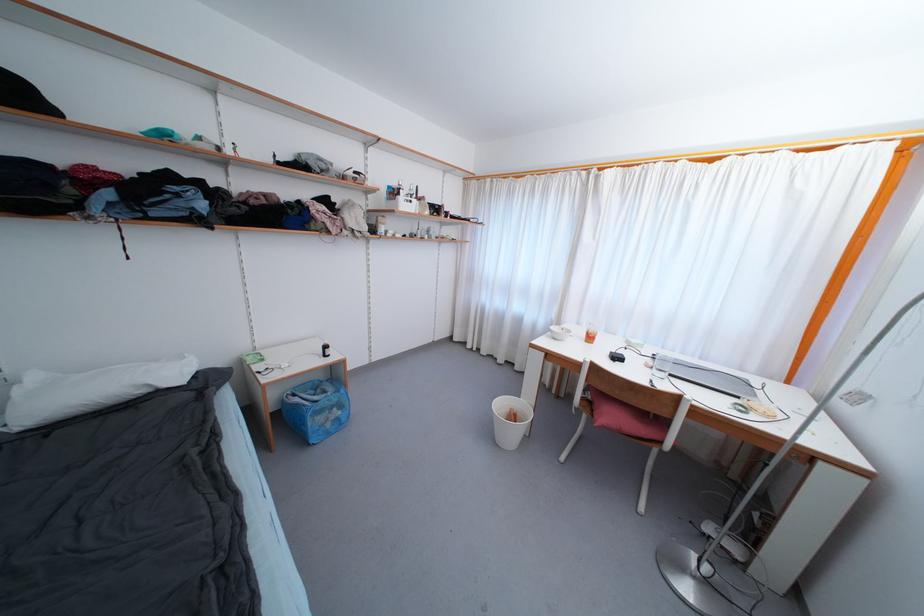
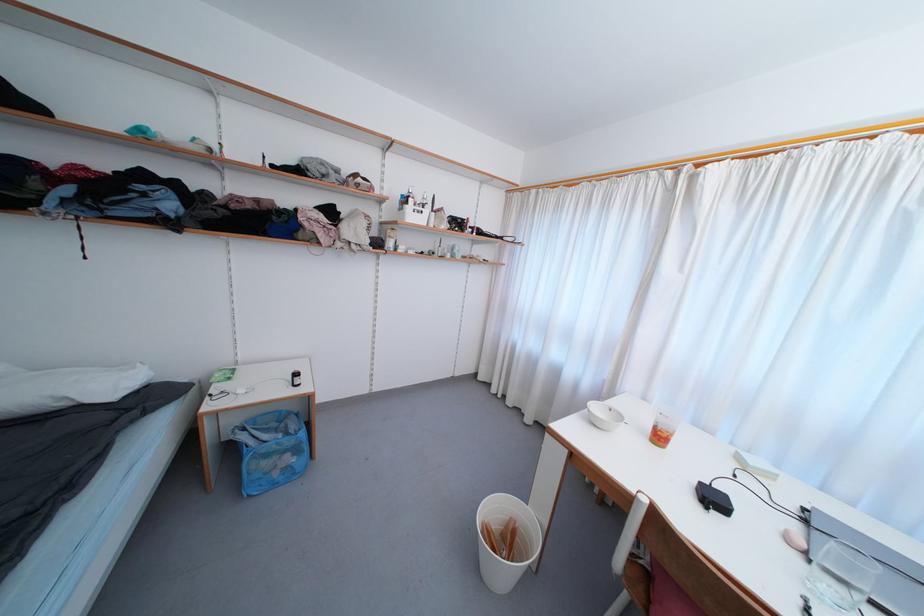
The images are taken continuously from a first-person perspective. In which direction are you moving?

The movement direction of the cameraman is right, forward.